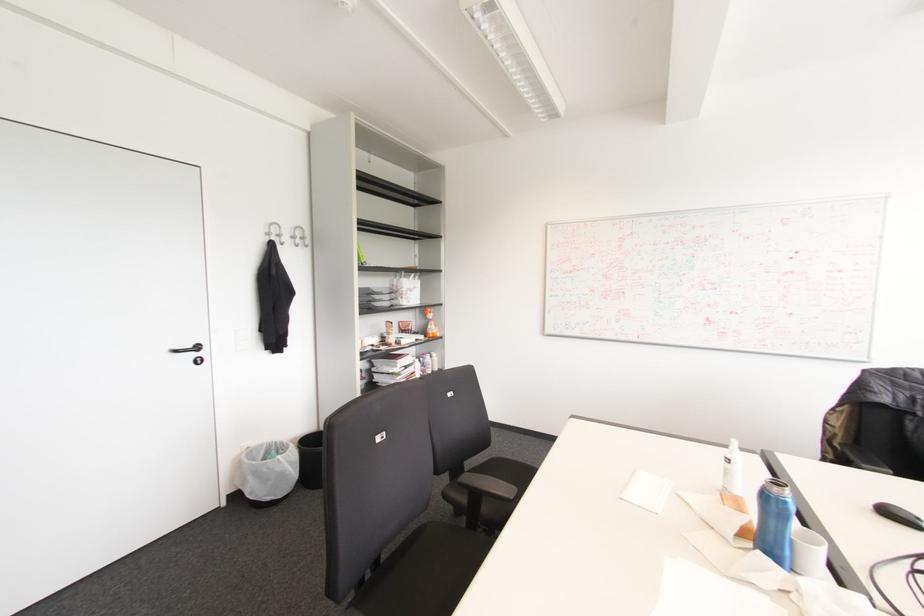
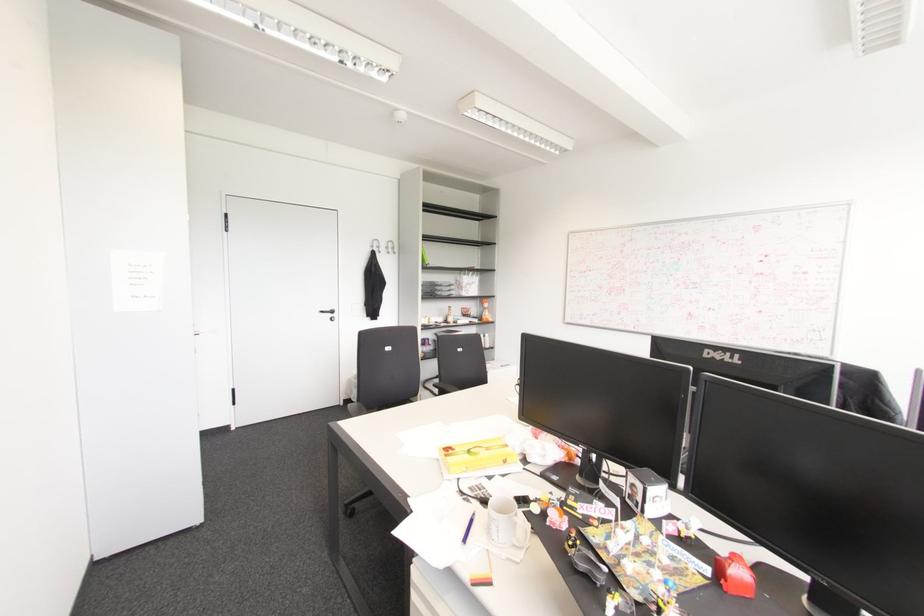
In the second image, find the point that corresponds to pixel 430 315 in the first image.

(485, 305)